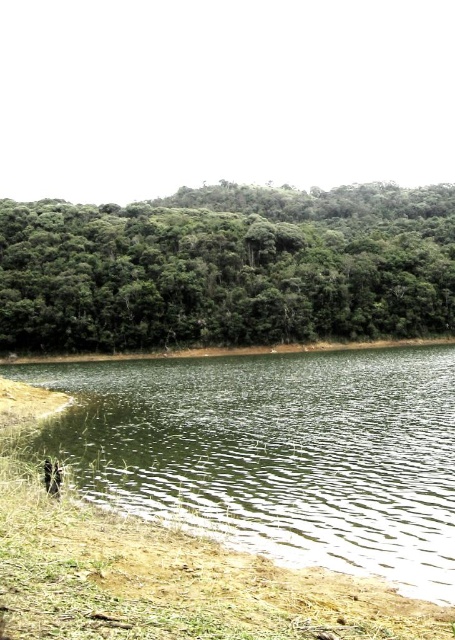
You are standing at the edge of the lake and see the green liquid water at lower center and the brown fur animal at lower left. Which object is closer to you?

The green liquid water at lower center is closer to you because it is in front of the brown fur animal at lower left.